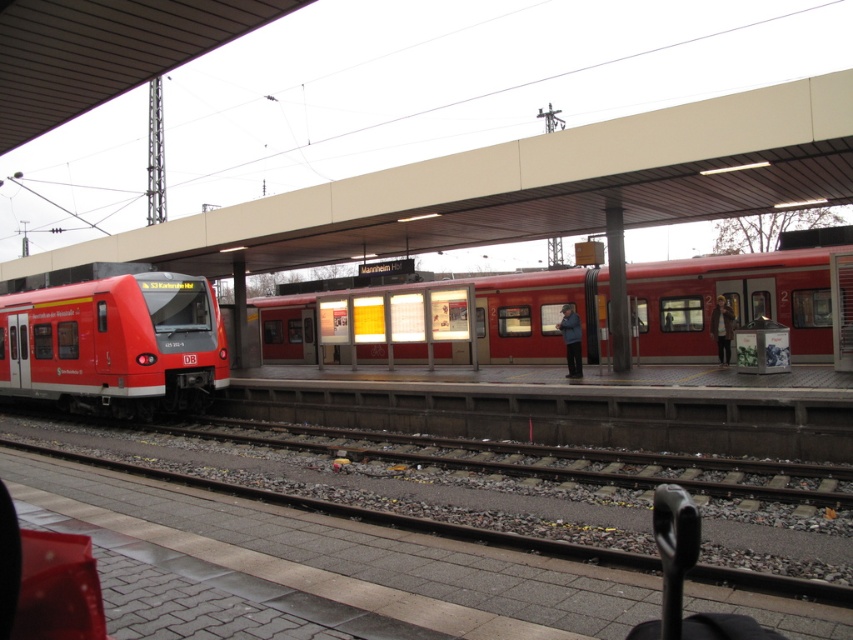
You are a passenger waiting on the platform and want to board the nearest train. Which train, the matte red train at center or the matte red train at left, is closer to you?

The matte red train at left is closer to you because it is positioned to the left of the center train, which is further away.